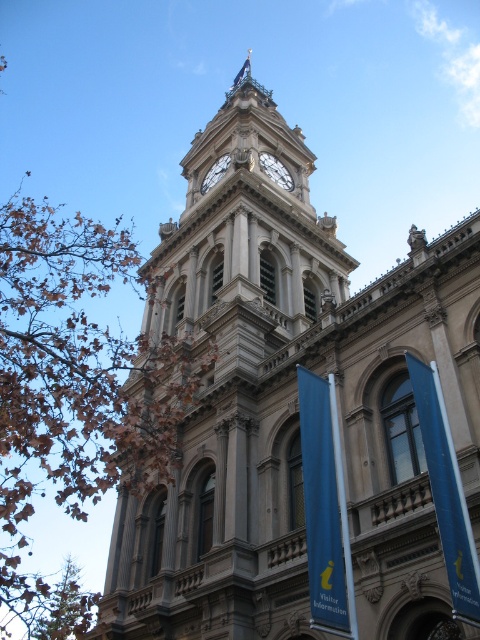
You are a tourist standing 100 meters away from the building. You want to walk towards the white stone clock at center but need to avoid the blue fabric flag at center. Can you reach the clock without passing near the flag?

The blue fabric flag at center is 53.57 meters from the white stone clock at center. Since you are starting 100 meters away from the building, you can walk around the flag and still reach the clock as the distance between them allows for a path that avoids the flag.

Based on the photo, you are standing in front of the grand building and want to locate the gold metallic clock at center. According to the coordinates provided, where would you look relative to the building?

The gold metallic clock at center is located at coordinates point (276, 170), which means it is positioned slightly to the left and halfway up the building from the bottom.